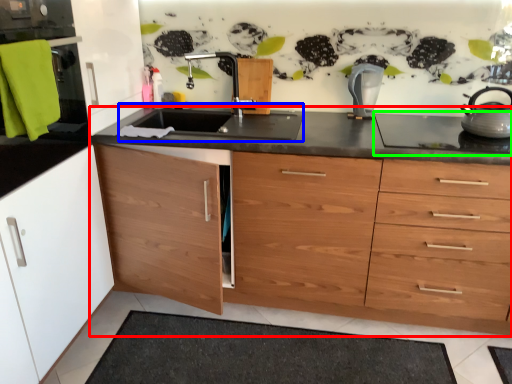
Question: Estimate the real-world distances between objects in this image. Which object is closer to countertop (highlighted by a red box), sink (highlighted by a blue box) or gas stove (highlighted by a green box)?

Choices:
 (A) sink
 (B) gas stove

Answer: (A)